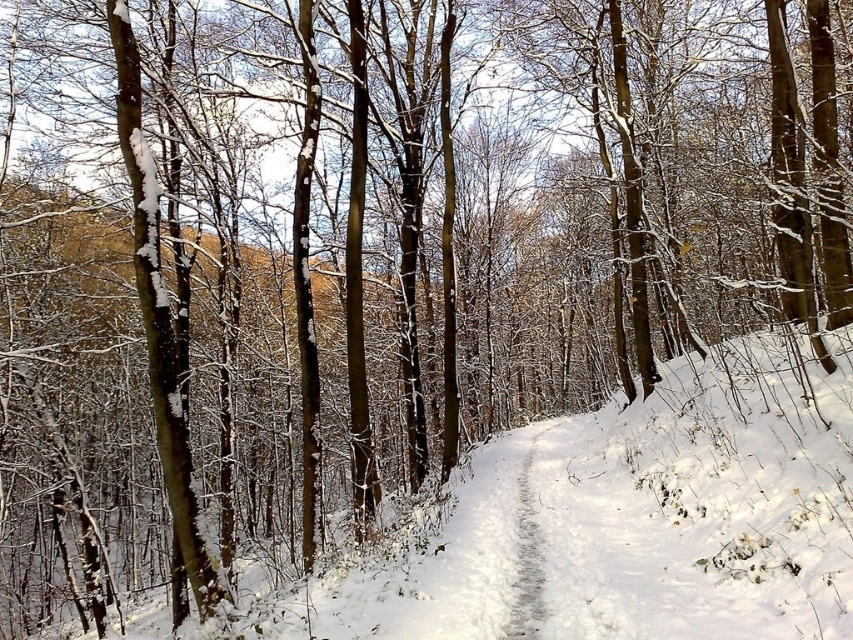
Question: Can you confirm if white fluffy snow at center is bigger than gray textured trail at center?

Choices:
 (A) no
 (B) yes

Answer: (B)

Question: Is white fluffy snow at center positioned in front of gray textured trail at center?

Choices:
 (A) no
 (B) yes

Answer: (B)

Question: Can you confirm if white fluffy snow at center is positioned to the left of gray textured trail at center?

Choices:
 (A) yes
 (B) no

Answer: (A)

Question: Among these points, which one is nearest to the camera?

Choices:
 (A) (523, 500)
 (B) (773, 346)

Answer: (B)

Question: Among these objects, which one is farthest from the camera?

Choices:
 (A) gray textured trail at center
 (B) white fluffy snow at center

Answer: (A)